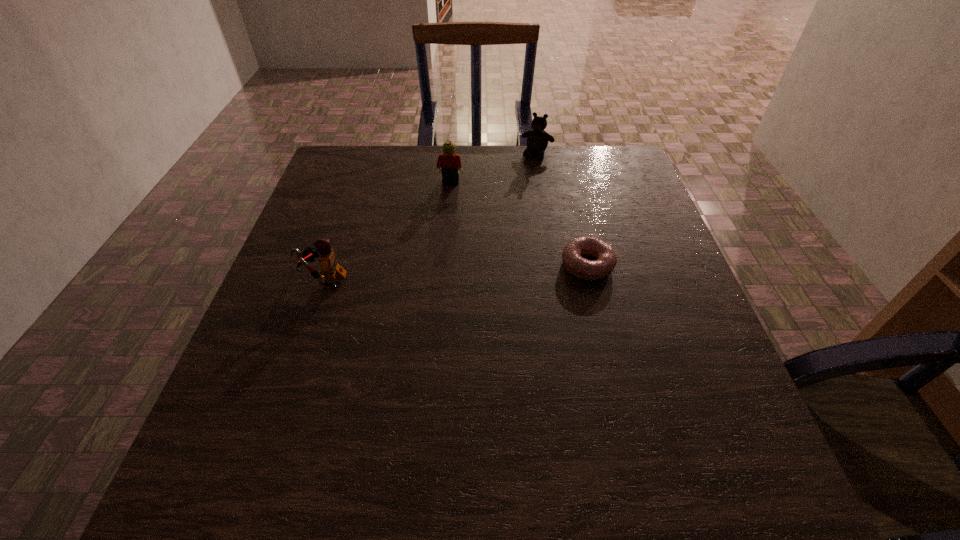
The image size is (960, 540). Find the location of `free space located at the face of the teddy bear`. free space located at the face of the teddy bear is located at coordinates (521, 188).

What are the coordinates of `vacant space positioned at the face of the teddy bear` in the screenshot? It's located at (512, 209).

You are a GUI agent. You are given a task and a screenshot of the screen. Output one action in this format:
    pyautogui.click(x=<x>, y=<y>)
    Task: Click on the vacant space located 0.090m at the face of the teddy bear
    The image size is (960, 540).
    Given the screenshot: What is the action you would take?
    pyautogui.click(x=526, y=178)

Locate an element on the screen. The width and height of the screenshot is (960, 540). Lego at the far edge is located at coordinates (450, 163).

Locate an element on the screen. teddy bear positioned at the far edge is located at coordinates (537, 139).

Find the location of a particular element. Image resolution: width=960 pixels, height=540 pixels. object that is at the left edge is located at coordinates (330, 268).

The height and width of the screenshot is (540, 960). Find the location of `object that is at the right edge`. object that is at the right edge is located at coordinates (573, 262).

Locate an element on the screen. This screenshot has width=960, height=540. free space at the far edge is located at coordinates (482, 171).

The height and width of the screenshot is (540, 960). I want to click on free space at the near edge, so click(565, 407).

The height and width of the screenshot is (540, 960). In the image, there is a desktop. Find the location of `vacant space at the left edge`. vacant space at the left edge is located at coordinates (272, 362).